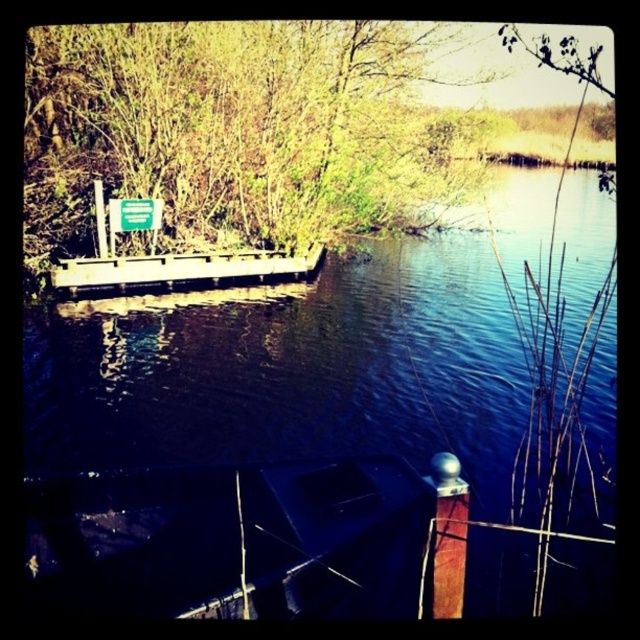
Can you confirm if blue water at center is positioned below wooden dock at center?

No.

Does blue water at center appear over wooden dock at center?

Correct, blue water at center is located above wooden dock at center.

Between point (538, 506) and point (202, 280), which one is positioned behind?

The point (202, 280) is more distant.

This screenshot has width=640, height=640. In order to click on blue water at center in this screenshot , I will do `click(336, 433)`.